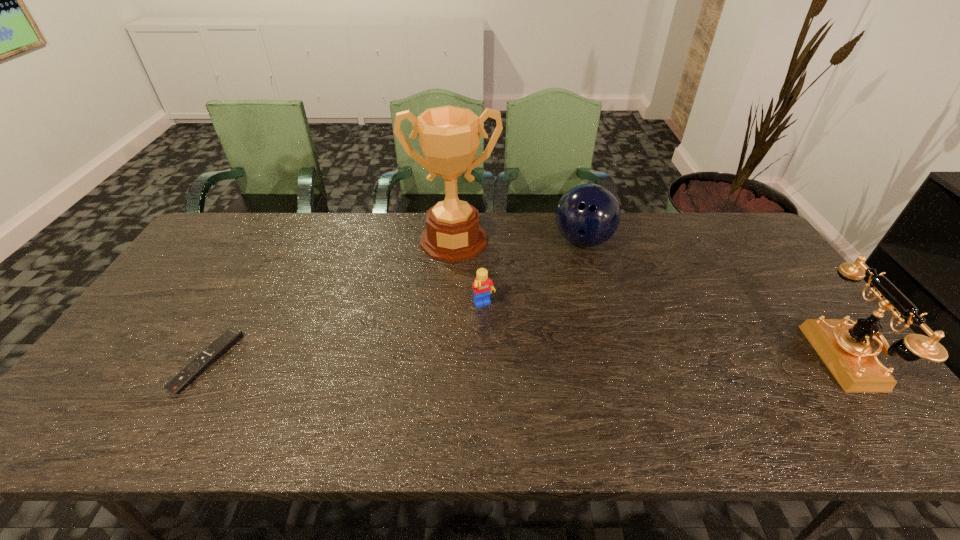
Locate an element on the screen. free space on the desktop that is between the remote control and the rightmost object and is positioned on the front-facing side of the tallest object is located at coordinates (449, 361).

Where is `vacant space on the desktop that is between the shortest object and the rightmost object and is positioned on the face of the Lego`? vacant space on the desktop that is between the shortest object and the rightmost object and is positioned on the face of the Lego is located at coordinates (514, 360).

Find the location of `free space on the desktop that is between the shortest object and the rightmost object and is positioned on the surface of the bowling ball near the finger holes`. free space on the desktop that is between the shortest object and the rightmost object and is positioned on the surface of the bowling ball near the finger holes is located at coordinates (609, 360).